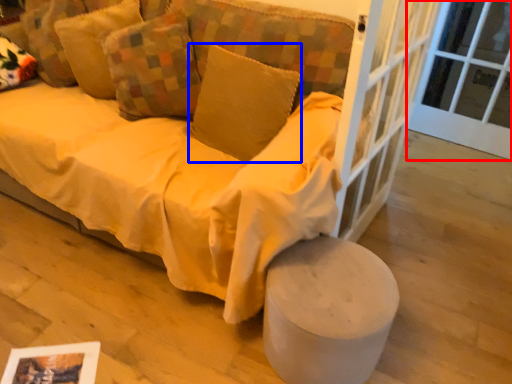
Question: Among these objects, which one is farthest to the camera, window frame (highlighted by a red box) or pillow (highlighted by a blue box)?

Choices:
 (A) window frame
 (B) pillow

Answer: (A)